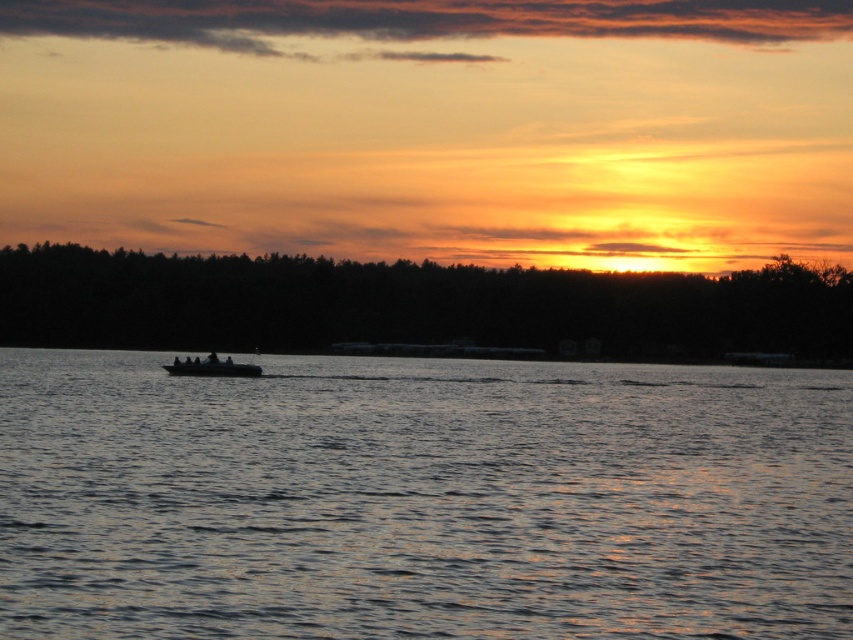
Question: Is dark blue water at center to the left of dark gray metallic boat at center from the viewer's perspective?

Choices:
 (A) yes
 (B) no

Answer: (B)

Question: Among these objects, which one is nearest to the camera?

Choices:
 (A) dark blue water at center
 (B) dark gray metallic boat at center

Answer: (A)

Question: Among these points, which one is nearest to the camera?

Choices:
 (A) (616, 552)
 (B) (177, 362)

Answer: (A)

Question: Is dark blue water at center above dark gray metallic boat at center?

Choices:
 (A) no
 (B) yes

Answer: (A)

Question: Does dark blue water at center have a greater width compared to dark gray metallic boat at center?

Choices:
 (A) yes
 (B) no

Answer: (A)